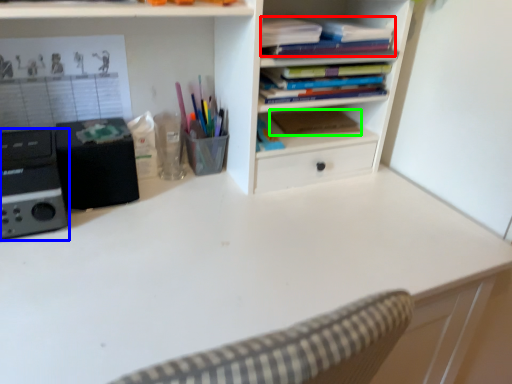
Question: Which is nearer to the book (highlighted by a red box)? appliance (highlighted by a blue box) or paperback book (highlighted by a green box).

Choices:
 (A) appliance
 (B) paperback book

Answer: (B)